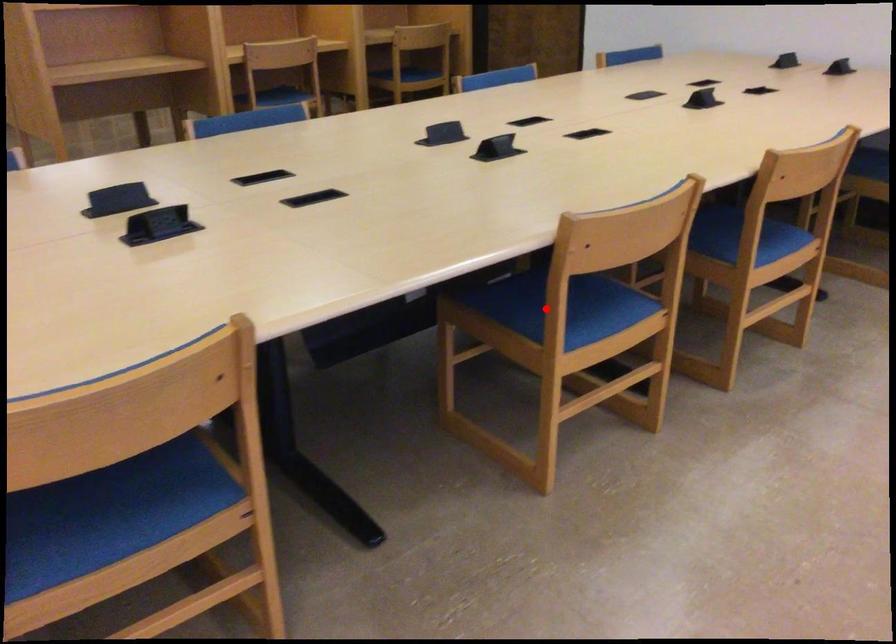
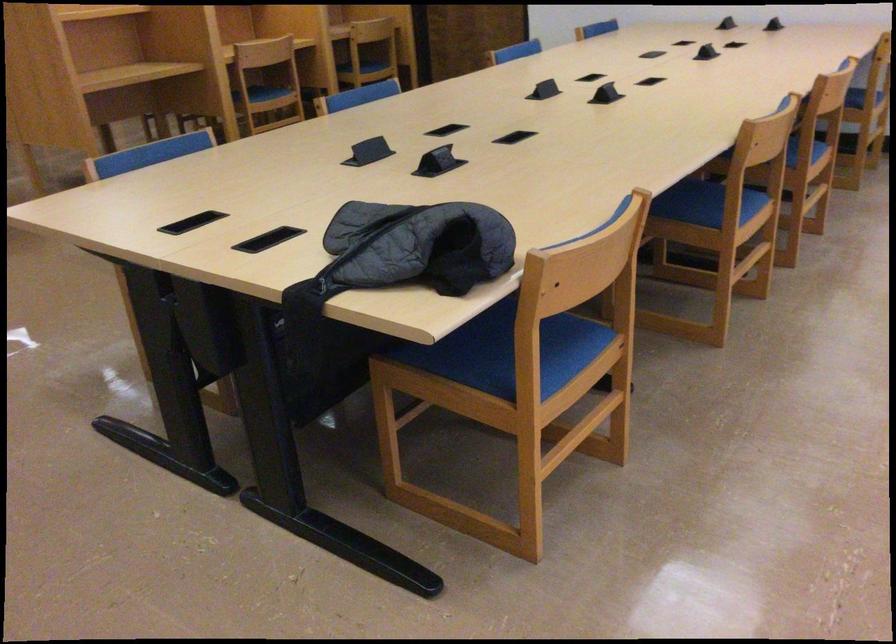
Question: I am providing you with two images of the same scene from different viewpoints. Image1 has a red point marked. In image2, the corresponding 3D location appears at what relative position? Reply with the corresponding letter.

Choices:
 (A) Closer
 (B) Farther

Answer: (B)